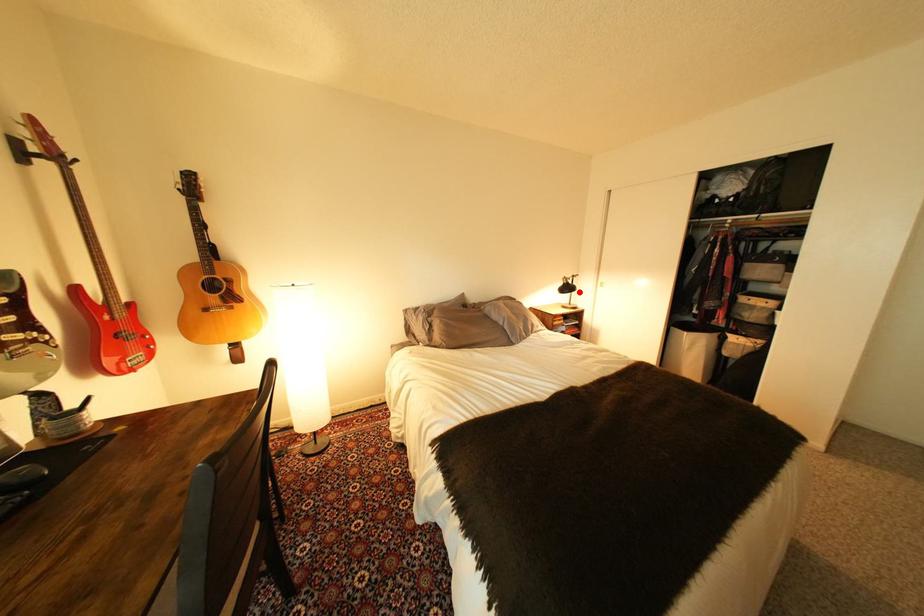
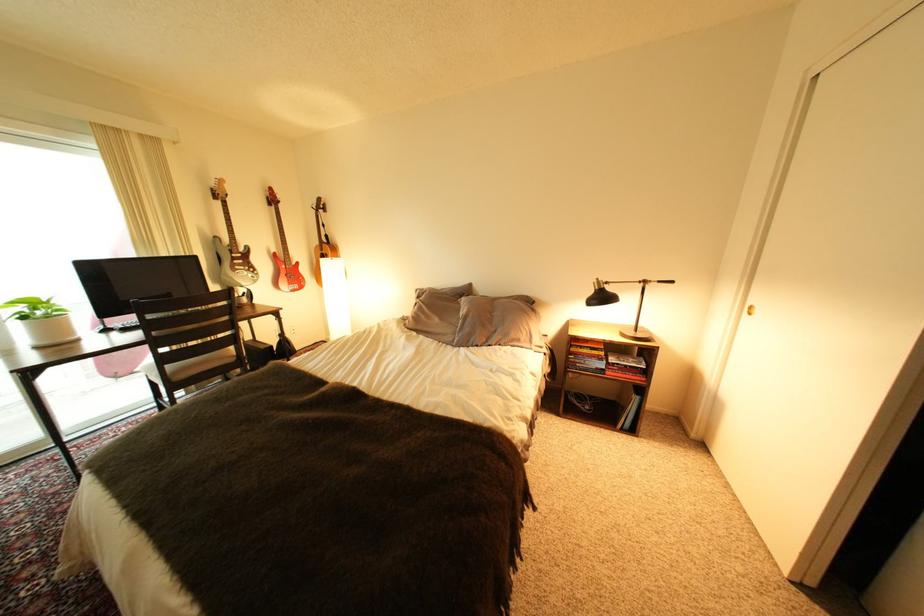
Question: A red point is marked in image1. In image2, is the corresponding 3D point closer to the camera or farther? Reply with the corresponding letter.

Choices:
 (A) The corresponding 3D point is closer.
 (B) The corresponding 3D point is farther.

Answer: (B)